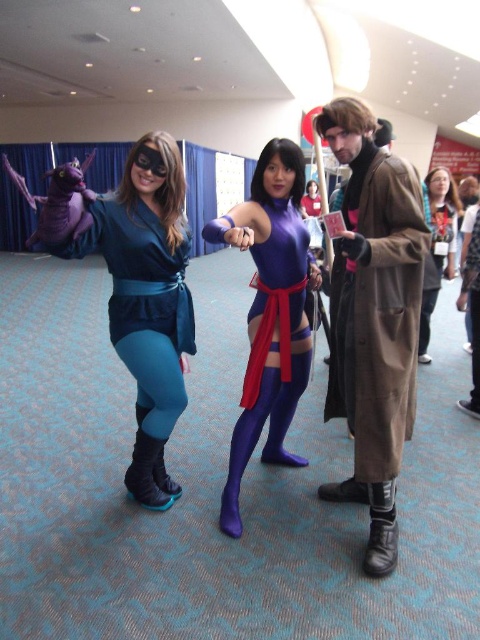
You are a photographer at the event and need to decide where to place a narrow 20cm wide spotlight. The spotlight must fit between the brown leather trench coat at right and the shiny purple bodysuit at center without overlapping either. Is this possible?

The brown leather trench coat at right is thinner than the shiny purple bodysuit at center. Since the trench coat is thinner, there might be enough space between them for the 20cm spotlight. However, without exact distance measurements, we cannot confirm for certain. The answer depends on the actual spacing between the two objects.